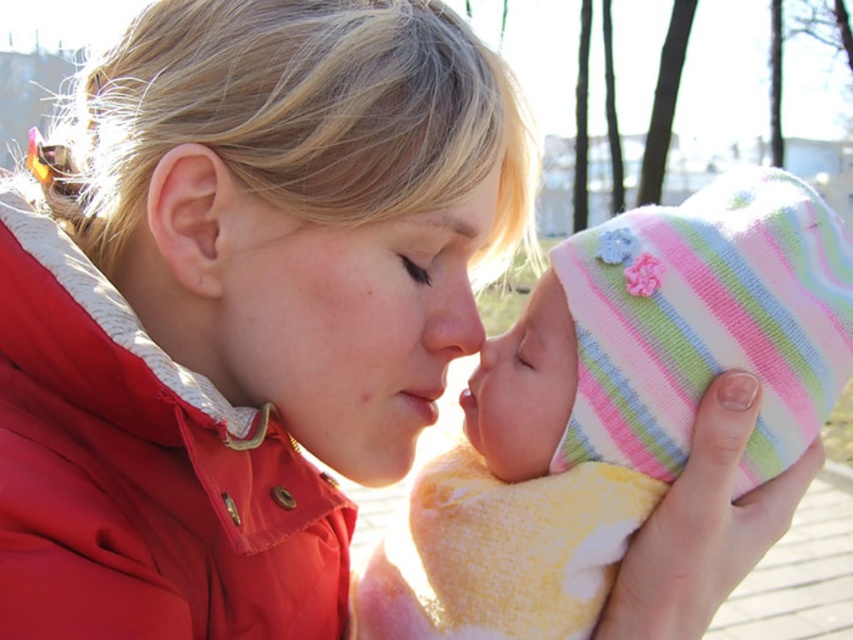
Is red quilted jacket at center closer to camera compared to matte skin forehead at upper center?

Yes.

Is point (288, 634) positioned in front of point (407, 230)?

No, (288, 634) is behind (407, 230).

Which is in front, point (235, 499) or point (480, 230)?

Point (235, 499) is more forward.

The height and width of the screenshot is (640, 853). Find the location of `red quilted jacket at center`. red quilted jacket at center is located at coordinates (143, 476).

Based on the photo, can you confirm if red quilted jacket at center is positioned to the left of smooth skin face at center?

Yes, red quilted jacket at center is to the left of smooth skin face at center.

Who is shorter, red quilted jacket at center or smooth skin face at center?

→ smooth skin face at center

Does point (148, 568) come behind point (254, 307)?

No, it is in front of (254, 307).

In order to click on red quilted jacket at center in this screenshot , I will do `click(143, 476)`.

Who is more distant from viewer, (589, 525) or (49, 552)?

Point (589, 525)

Is pastel striped knit hat at center further to the viewer compared to red quilted jacket at center?

That is True.

The height and width of the screenshot is (640, 853). What do you see at coordinates (614, 406) in the screenshot? I see `pastel striped knit hat at center` at bounding box center [614, 406].

Identify the location of pastel striped knit hat at center. The image size is (853, 640). (614, 406).